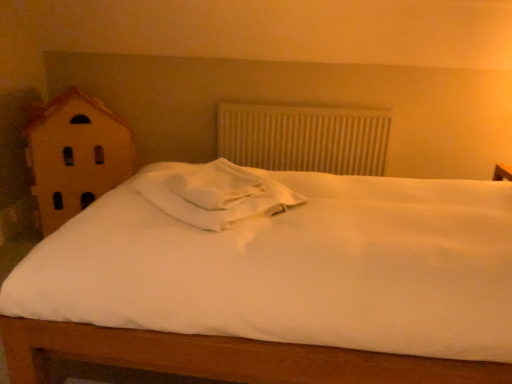
Question: Can you confirm if white soft pillow at center is smaller than white textured radiator at center?

Choices:
 (A) no
 (B) yes

Answer: (B)

Question: Is white soft pillow at center completely or partially outside of white textured radiator at center?

Choices:
 (A) no
 (B) yes

Answer: (B)

Question: From a real-world perspective, is white soft pillow at center over white textured radiator at center?

Choices:
 (A) no
 (B) yes

Answer: (B)

Question: From a real-world perspective, is white soft pillow at center beneath white textured radiator at center?

Choices:
 (A) yes
 (B) no

Answer: (B)

Question: Does white soft pillow at center touch white textured radiator at center?

Choices:
 (A) no
 (B) yes

Answer: (A)

Question: Does white soft pillow at center turn towards white textured radiator at center?

Choices:
 (A) no
 (B) yes

Answer: (A)

Question: Is white soft pillow at center in front of wooden house at left?

Choices:
 (A) no
 (B) yes

Answer: (B)

Question: Considering the relative sizes of white soft pillow at center and wooden house at left in the image provided, is white soft pillow at center thinner than wooden house at left?

Choices:
 (A) yes
 (B) no

Answer: (B)

Question: Is white soft pillow at center behind wooden house at left?

Choices:
 (A) yes
 (B) no

Answer: (B)

Question: From the image's perspective, is white soft pillow at center beneath wooden house at left?

Choices:
 (A) no
 (B) yes

Answer: (B)

Question: Is white soft pillow at center aimed at wooden house at left?

Choices:
 (A) no
 (B) yes

Answer: (A)

Question: Is white soft pillow at center turned away from wooden house at left?

Choices:
 (A) yes
 (B) no

Answer: (B)

Question: Is white textured radiator at center not near wooden house at left?

Choices:
 (A) yes
 (B) no

Answer: (B)